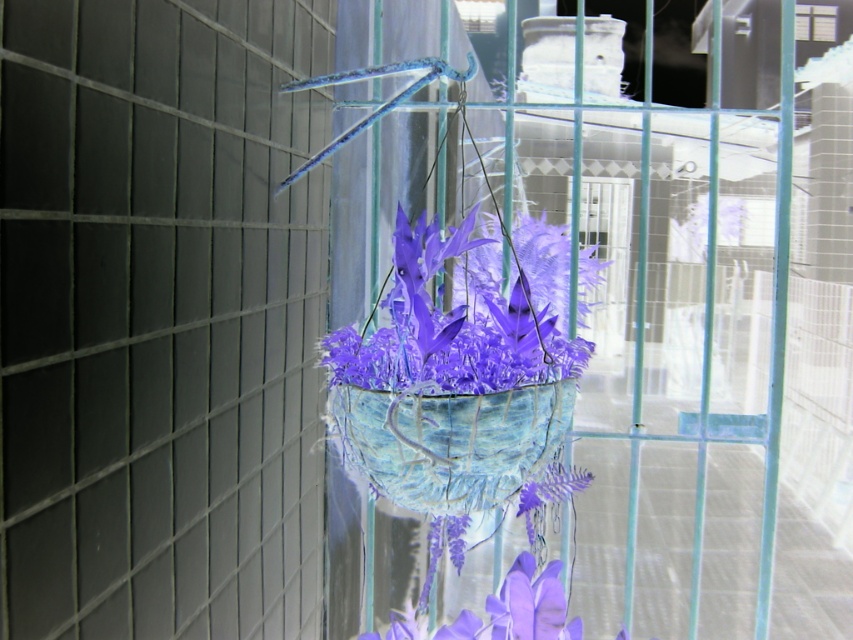
Is matte purple paper flowers at center closer to camera compared to textured blue basket at center?

No, matte purple paper flowers at center is further to the viewer.

Is matte purple paper flowers at center to the left of textured blue basket at center from the viewer's perspective?

In fact, matte purple paper flowers at center is to the right of textured blue basket at center.

Between point (451, 355) and point (450, 488), which one is positioned behind?

Positioned behind is point (451, 355).

Image resolution: width=853 pixels, height=640 pixels. I want to click on matte purple paper flowers at center, so click(463, 316).

Can you confirm if matte blue fabric basket at center is bigger than textured blue basket at center?

Yes.

How distant is matte blue fabric basket at center from textured blue basket at center?

They are 18.54 centimeters apart.

Is point (544, 289) farther from viewer compared to point (466, 433)?

Yes, it is.

Find the location of a particular element. This screenshot has height=640, width=853. matte blue fabric basket at center is located at coordinates (461, 380).

Does matte blue fabric basket at center have a larger size compared to matte purple paper flowers at center?

Yes, matte blue fabric basket at center is bigger than matte purple paper flowers at center.

Between point (457, 323) and point (329, 349), which one is positioned in front?

Positioned in front is point (457, 323).

Find the location of a particular element. The height and width of the screenshot is (640, 853). matte blue fabric basket at center is located at coordinates [461, 380].

Identify the location of matte blue fabric basket at center. (461, 380).